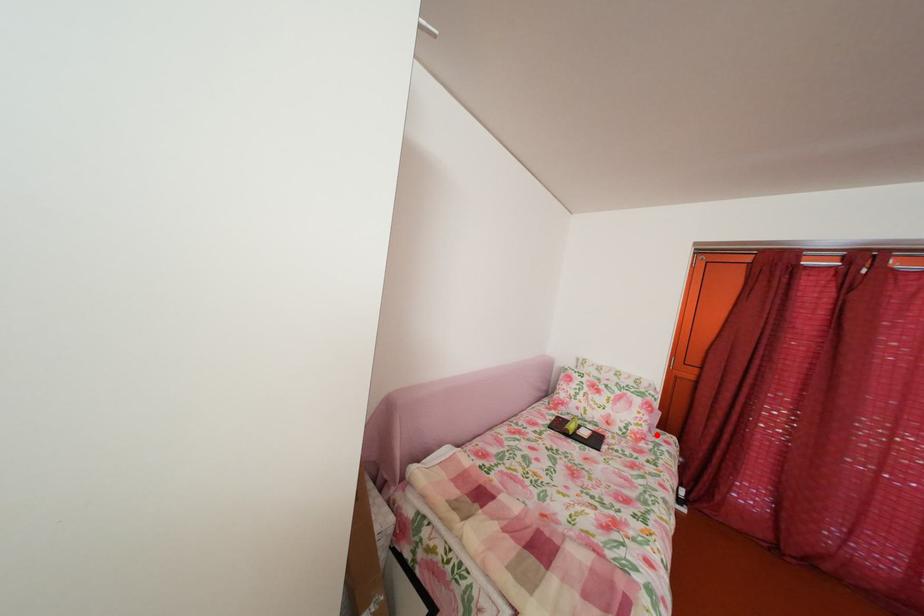
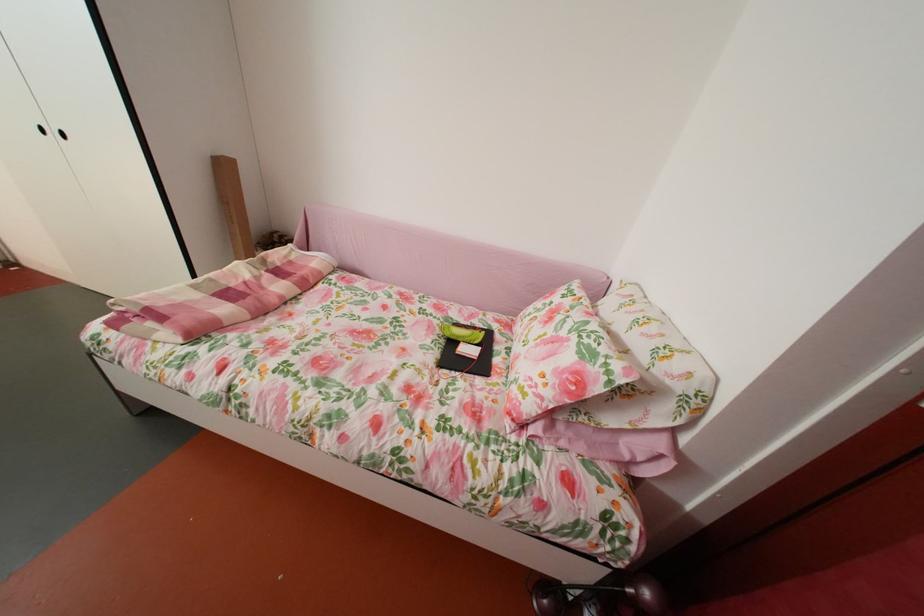
Find the pixel in the second image that matches the highlighted location in the first image.

(541, 413)